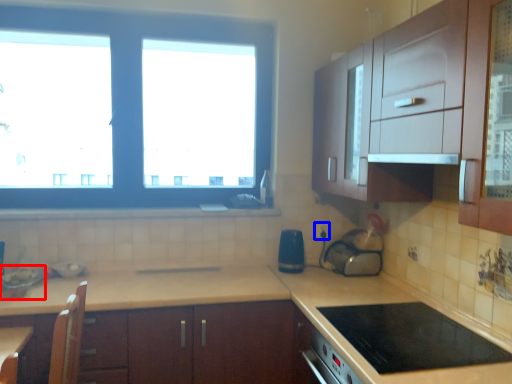
Question: Which point is further to the camera, appliance (highlighted by a red box) or electric outlet (highlighted by a blue box)?

Choices:
 (A) appliance
 (B) electric outlet

Answer: (B)